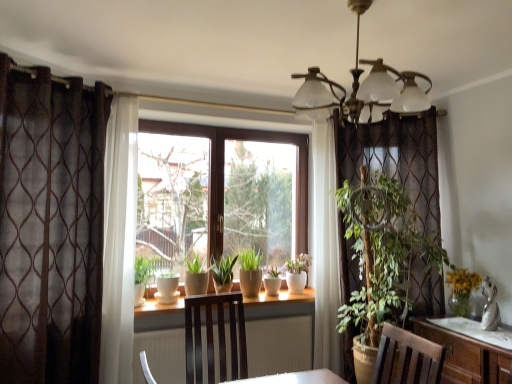
You are a GUI agent. You are given a task and a screenshot of the screen. Output one action in this format:
    pyautogui.click(x=<x>, y=<y>)
    Task: Click on the metallic brass chandelier at upper center
    The width and height of the screenshot is (512, 384).
    Given the screenshot: What is the action you would take?
    pyautogui.click(x=361, y=89)

The width and height of the screenshot is (512, 384). Describe the element at coordinates (51, 225) in the screenshot. I see `brown sheer curtain at left` at that location.

How much space does white ceramic flowerpot at center, which ranks as the 2th flowerpot in left-to-right order, occupy vertically?

white ceramic flowerpot at center, which ranks as the 2th flowerpot in left-to-right order, is 8.84 inches tall.

Locate an element on the screen. matte ceramic pot at center, positioned as the second flowerpot in right-to-left order is located at coordinates (250, 282).

Locate an element on the screen. metallic brass chandelier at upper center is located at coordinates (361, 89).

Is metallic brass chandelier at upper center inside brown sheer curtain at left?

No, metallic brass chandelier at upper center is not a part of brown sheer curtain at left.

How much distance is there between brown sheer curtain at left and metallic brass chandelier at upper center?

brown sheer curtain at left and metallic brass chandelier at upper center are 1.72 meters apart from each other.

Is brown sheer curtain at left shorter than metallic brass chandelier at upper center?

In fact, brown sheer curtain at left may be taller than metallic brass chandelier at upper center.

Consider the image. Which object is positioned more to the left, brown sheer curtain at left or metallic brass chandelier at upper center?

brown sheer curtain at left.

Who is smaller, white ceramic flowerpot at center, the 1th flowerpot in the right-to-left sequence, or white ceramic pot at center?

white ceramic flowerpot at center, the 1th flowerpot in the right-to-left sequence, is smaller.

Does white ceramic flowerpot at center, which ranks as the 2th flowerpot in left-to-right order, turn towards white ceramic pot at center?

No, white ceramic flowerpot at center, which ranks as the 2th flowerpot in left-to-right order, is not facing towards white ceramic pot at center.

Would you say white ceramic flowerpot at center, which ranks as the 2th flowerpot in left-to-right order, contains white ceramic pot at center?

No, white ceramic pot at center is not surrounded by white ceramic flowerpot at center, which ranks as the 2th flowerpot in left-to-right order.

From the image's perspective, is white ceramic flowerpot at center, which ranks as the 2th flowerpot in left-to-right order, over white ceramic pot at center?

Yes, from the image's perspective, white ceramic flowerpot at center, which ranks as the 2th flowerpot in left-to-right order, is over white ceramic pot at center.

Is white ceramic pot at center behind metallic brass chandelier at upper center?

Yes, the depth of white ceramic pot at center is greater than that of metallic brass chandelier at upper center.

Is metallic brass chandelier at upper center at the back of white ceramic pot at center?

No, metallic brass chandelier at upper center is not at the back of white ceramic pot at center.

Can you see white ceramic pot at center touching metallic brass chandelier at upper center?

No, white ceramic pot at center is not making contact with metallic brass chandelier at upper center.

Consider the image. Does metallic brass chandelier at upper center have a greater width compared to matte ceramic pot at center, which is counted as the first flowerpot, starting from the left?

Correct, the width of metallic brass chandelier at upper center exceeds that of matte ceramic pot at center, which is counted as the first flowerpot, starting from the left.

Where is `light fixture above the matte ceramic pot at center, which is counted as the first flowerpot, starting from the left (from a real-world perspective)`? Image resolution: width=512 pixels, height=384 pixels. light fixture above the matte ceramic pot at center, which is counted as the first flowerpot, starting from the left (from a real-world perspective) is located at coordinates (361, 89).

Is metallic brass chandelier at upper center looking in the opposite direction of matte ceramic pot at center, which is counted as the first flowerpot, starting from the left?

No, metallic brass chandelier at upper center is not facing the opposite direction of matte ceramic pot at center, which is counted as the first flowerpot, starting from the left.

Can you tell me how much metallic brass chandelier at upper center and matte ceramic pot at center, which is counted as the first flowerpot, starting from the left, differ in facing direction?

3.97 degrees.

Which is behind, metallic brass chandelier at upper center or white ceramic flowerpot at center, the 1th flowerpot in the right-to-left sequence?

white ceramic flowerpot at center, the 1th flowerpot in the right-to-left sequence, is further away from the camera.

Is point (360, 1) closer to camera compared to point (264, 280)?

Yes, point (360, 1) is in front of point (264, 280).

From the image's perspective, who appears lower, metallic brass chandelier at upper center or white ceramic flowerpot at center, which ranks as the 2th flowerpot in left-to-right order?

From the image's view, white ceramic flowerpot at center, which ranks as the 2th flowerpot in left-to-right order, is below.

From the image's perspective, which one is positioned higher, matte ceramic pot at center, which is counted as the first flowerpot, starting from the left, or white ceramic flowerpot at center, the 1th flowerpot in the right-to-left sequence?

white ceramic flowerpot at center, the 1th flowerpot in the right-to-left sequence, appears higher in the image.

Is matte ceramic pot at center, which is counted as the first flowerpot, starting from the left, outside of white ceramic flowerpot at center, which ranks as the 2th flowerpot in left-to-right order?

Yes, matte ceramic pot at center, which is counted as the first flowerpot, starting from the left, is not within white ceramic flowerpot at center, which ranks as the 2th flowerpot in left-to-right order.

In the scene shown: Is matte ceramic pot at center, positioned as the second flowerpot in right-to-left order, next to white ceramic flowerpot at center, the 1th flowerpot in the right-to-left sequence, and touching it?

No, matte ceramic pot at center, positioned as the second flowerpot in right-to-left order, is not touching white ceramic flowerpot at center, the 1th flowerpot in the right-to-left sequence.

You are a GUI agent. You are given a task and a screenshot of the screen. Output one action in this format:
    pyautogui.click(x=<x>, y=<y>)
    Task: Click on the houseplant below the matte ceramic pot at center, positioned as the second flowerpot in right-to-left order (from the image's perspective)
    
    Given the screenshot: What is the action you would take?
    pyautogui.click(x=297, y=273)

Relative to matte ceramic pot at center, which is counted as the first flowerpot, starting from the left, is white ceramic pot at center in front or behind?

white ceramic pot at center is behind matte ceramic pot at center, which is counted as the first flowerpot, starting from the left.

From the image's perspective, is white ceramic pot at center over matte ceramic pot at center, which is counted as the first flowerpot, starting from the left?

No, from the image's perspective, white ceramic pot at center is not over matte ceramic pot at center, which is counted as the first flowerpot, starting from the left.

Identify the location of light fixture on the right of brown sheer curtain at left. (361, 89).

Locate an element on the screen. The width and height of the screenshot is (512, 384). flowerpot above the white ceramic pot at center (from a real-world perspective) is located at coordinates (272, 285).

Considering their positions, is brown sheer curtain at left positioned closer to white ceramic flowerpot at center, which ranks as the 2th flowerpot in left-to-right order, than metallic brass chandelier at upper center?

brown sheer curtain at left lies closer to white ceramic flowerpot at center, which ranks as the 2th flowerpot in left-to-right order, than the other object.

From the image, which object appears to be farther from matte ceramic pot at center, positioned as the second flowerpot in right-to-left order, white ceramic flowerpot at center, the 1th flowerpot in the right-to-left sequence, or white ceramic pot at center?

The object further to matte ceramic pot at center, positioned as the second flowerpot in right-to-left order, is white ceramic pot at center.

Which object lies further to the anchor point matte ceramic pot at center, positioned as the second flowerpot in right-to-left order, brown sheer curtain at left or white ceramic pot at center?

Among the two, brown sheer curtain at left is located further to matte ceramic pot at center, positioned as the second flowerpot in right-to-left order.

Based on their spatial positions, is brown sheer curtain at left or matte ceramic pot at center, which is counted as the first flowerpot, starting from the left, further from white ceramic flowerpot at center, which ranks as the 2th flowerpot in left-to-right order?

Based on the image, brown sheer curtain at left appears to be further to white ceramic flowerpot at center, which ranks as the 2th flowerpot in left-to-right order.

Considering their positions, is white ceramic pot at center positioned further to brown sheer curtain at left than white ceramic flowerpot at center, the 1th flowerpot in the right-to-left sequence?

Based on the image, white ceramic pot at center appears to be further to brown sheer curtain at left.

Based on their spatial positions, is metallic brass chandelier at upper center or matte ceramic pot at center, positioned as the second flowerpot in right-to-left order, further from white ceramic flowerpot at center, which ranks as the 2th flowerpot in left-to-right order?

metallic brass chandelier at upper center is further to white ceramic flowerpot at center, which ranks as the 2th flowerpot in left-to-right order.

Which object lies further to the anchor point white ceramic pot at center, matte ceramic pot at center, positioned as the second flowerpot in right-to-left order, or white ceramic flowerpot at center, the 1th flowerpot in the right-to-left sequence?

matte ceramic pot at center, positioned as the second flowerpot in right-to-left order, is positioned further to the anchor white ceramic pot at center.

Which object lies further to the anchor point white ceramic pot at center, white ceramic flowerpot at center, the 1th flowerpot in the right-to-left sequence, or brown sheer curtain at left?

brown sheer curtain at left lies further to white ceramic pot at center than the other object.

The height and width of the screenshot is (384, 512). Find the location of `curtain located between metallic brass chandelier at upper center and white ceramic pot at center in the depth direction`. curtain located between metallic brass chandelier at upper center and white ceramic pot at center in the depth direction is located at coordinates (51, 225).

The height and width of the screenshot is (384, 512). What are the coordinates of `curtain located between metallic brass chandelier at upper center and matte ceramic pot at center, which is counted as the first flowerpot, starting from the left, in the depth direction` in the screenshot? It's located at (51, 225).

Identify the location of flowerpot between brown sheer curtain at left and white ceramic flowerpot at center, the 1th flowerpot in the right-to-left sequence. (250, 282).

Identify the location of flowerpot between matte ceramic pot at center, positioned as the second flowerpot in right-to-left order, and white ceramic pot at center. The width and height of the screenshot is (512, 384). click(272, 285).